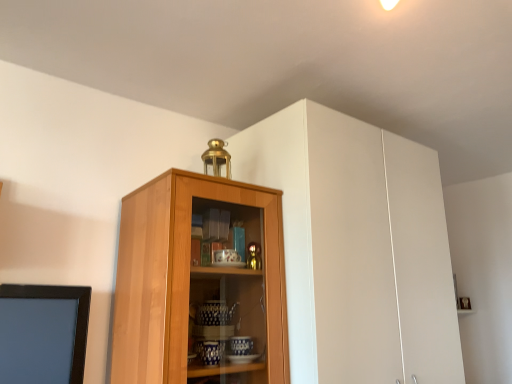
Image resolution: width=512 pixels, height=384 pixels. Find the location of `white matte cabinet at upper center`. white matte cabinet at upper center is located at coordinates (358, 247).

The image size is (512, 384). Describe the element at coordinates (358, 247) in the screenshot. I see `white matte cabinet at upper center` at that location.

The width and height of the screenshot is (512, 384). What do you see at coordinates (199, 287) in the screenshot? I see `light brown wood cabinet at center` at bounding box center [199, 287].

What are the coordinates of `light brown wood cabinet at center` in the screenshot? It's located at tap(199, 287).

This screenshot has width=512, height=384. I want to click on white matte cabinet at upper center, so click(358, 247).

Which object is positioned more to the right, white matte cabinet at upper center or light brown wood cabinet at center?

From the viewer's perspective, white matte cabinet at upper center appears more on the right side.

Which object is closer to the camera, white matte cabinet at upper center or light brown wood cabinet at center?

light brown wood cabinet at center is in front.

Which point is more forward, (x=325, y=380) or (x=134, y=287)?

The point (x=325, y=380) is closer.

From the image's perspective, would you say white matte cabinet at upper center is shown under light brown wood cabinet at center?

No, from the image's perspective, white matte cabinet at upper center is not beneath light brown wood cabinet at center.

From a real-world perspective, is white matte cabinet at upper center physically below light brown wood cabinet at center?

No, from a real-world perspective, white matte cabinet at upper center is not under light brown wood cabinet at center.

Is white matte cabinet at upper center wider or thinner than light brown wood cabinet at center?

In the image, white matte cabinet at upper center appears to be wider than light brown wood cabinet at center.

Can you confirm if white matte cabinet at upper center is shorter than light brown wood cabinet at center?

Incorrect, the height of white matte cabinet at upper center does not fall short of that of light brown wood cabinet at center.

Is white matte cabinet at upper center bigger or smaller than light brown wood cabinet at center?

Considering their sizes, white matte cabinet at upper center takes up more space than light brown wood cabinet at center.

From the picture: Is white matte cabinet at upper center located outside light brown wood cabinet at center?

That's correct, white matte cabinet at upper center is outside of light brown wood cabinet at center.

Is white matte cabinet at upper center next to light brown wood cabinet at center and touching it?

No, white matte cabinet at upper center is not with light brown wood cabinet at center.

Does white matte cabinet at upper center turn towards light brown wood cabinet at center?

No, white matte cabinet at upper center does not turn towards light brown wood cabinet at center.

Can you tell me how much white matte cabinet at upper center and light brown wood cabinet at center differ in facing direction?

There is a 2.42-degree angle between the facing directions of white matte cabinet at upper center and light brown wood cabinet at center.

Find the location of a particular element. cupboard in front of the white matte cabinet at upper center is located at coordinates (199, 287).

Which object is positioned more to the right, light brown wood cabinet at center or white matte cabinet at upper center?

From the viewer's perspective, white matte cabinet at upper center appears more on the right side.

Relative to white matte cabinet at upper center, is light brown wood cabinet at center in front or behind?

light brown wood cabinet at center is in front of white matte cabinet at upper center.

Between point (121, 301) and point (405, 220), which one is positioned in front?

The point (121, 301) is more forward.

From the image's perspective, which one is positioned lower, light brown wood cabinet at center or white matte cabinet at upper center?

light brown wood cabinet at center appears lower in the image.

Based on the photo, from a real-world perspective, is light brown wood cabinet at center located beneath white matte cabinet at upper center?

Correct, in the physical world, light brown wood cabinet at center is lower than white matte cabinet at upper center.

Considering the sizes of objects light brown wood cabinet at center and white matte cabinet at upper center in the image provided, who is thinner, light brown wood cabinet at center or white matte cabinet at upper center?

light brown wood cabinet at center.

Does light brown wood cabinet at center have a lesser height compared to white matte cabinet at upper center?

Yes, light brown wood cabinet at center is shorter than white matte cabinet at upper center.

Does light brown wood cabinet at center have a smaller size compared to white matte cabinet at upper center?

Indeed, light brown wood cabinet at center has a smaller size compared to white matte cabinet at upper center.

Is white matte cabinet at upper center a part of light brown wood cabinet at center?

No, white matte cabinet at upper center is not a part of light brown wood cabinet at center.

Is light brown wood cabinet at center far away from white matte cabinet at upper center?

No, light brown wood cabinet at center is in close proximity to white matte cabinet at upper center.

Is light brown wood cabinet at center oriented towards white matte cabinet at upper center?

No, light brown wood cabinet at center is not aimed at white matte cabinet at upper center.

Can you tell me how much light brown wood cabinet at center and white matte cabinet at upper center differ in facing direction?

The angle between the facing direction of light brown wood cabinet at center and the facing direction of white matte cabinet at upper center is 2.42 degrees.

This screenshot has height=384, width=512. I want to click on cupboard below the white matte cabinet at upper center (from a real-world perspective), so click(x=199, y=287).

The image size is (512, 384). Find the location of `cabinetry above the light brown wood cabinet at center (from the image's perspective)`. cabinetry above the light brown wood cabinet at center (from the image's perspective) is located at coordinates (358, 247).

You are a GUI agent. You are given a task and a screenshot of the screen. Output one action in this format:
    pyautogui.click(x=<x>, y=<y>)
    Task: Click on the cupboard below the white matte cabinet at upper center (from the image's perspective)
    
    Given the screenshot: What is the action you would take?
    pyautogui.click(x=199, y=287)